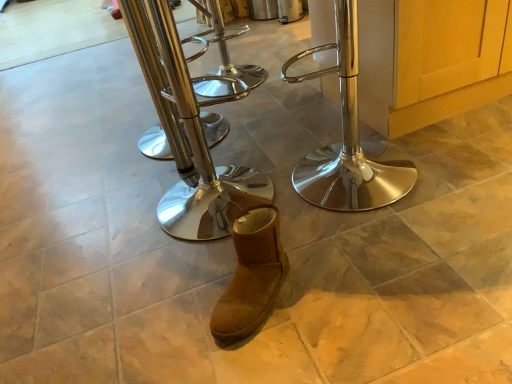
You are a GUI agent. You are given a task and a screenshot of the screen. Output one action in this format:
    pyautogui.click(x=<x>, y=<y>)
    Task: Click on the vacant area to the right of brown suede boot at center
    
    Given the screenshot: What is the action you would take?
    pyautogui.click(x=324, y=286)